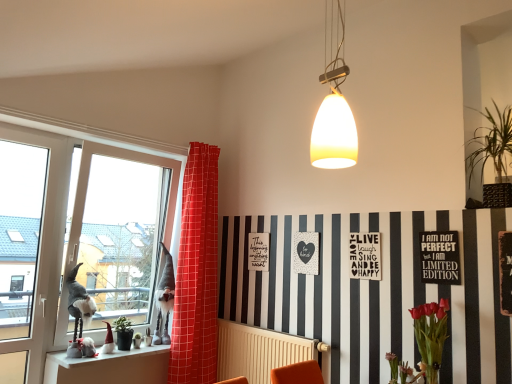
Question: Is green matte plant at lower left, the second plant from the right, situated inside beige radiator at lower center or outside?

Choices:
 (A) outside
 (B) inside

Answer: (A)

Question: In terms of height, does green matte plant at lower left, which ranks as the first plant in bottom-to-top order, look taller or shorter compared to beige radiator at lower center?

Choices:
 (A) tall
 (B) short

Answer: (B)

Question: Estimate the real-world distances between objects in this image. Which object is farther from the matte white pendant light at upper center?

Choices:
 (A) black matte signboard at upper center, which appears as the 1th postcard when viewed from the front
 (B) black wood sign at right, the 2th bulletin board positioned from the left
 (C) red checkered curtain at window
 (D) white matte postcard at center, which ranks as the 1th postcard in back-to-front order
 (E) black matte signboard at upper right, which is the first bulletin board in left-to-right order

Answer: (C)

Question: Which of these objects is positioned closest to the transparent glass window at left?

Choices:
 (A) matte white pendant light at upper center
 (B) black wood sign at right, the 2th bulletin board positioned from the left
 (C) transparent glass screen door at left
 (D) green leafy plant at upper right, acting as the 2th plant starting from the left
 (E) white ceramic gnomes at lower left

Answer: (E)